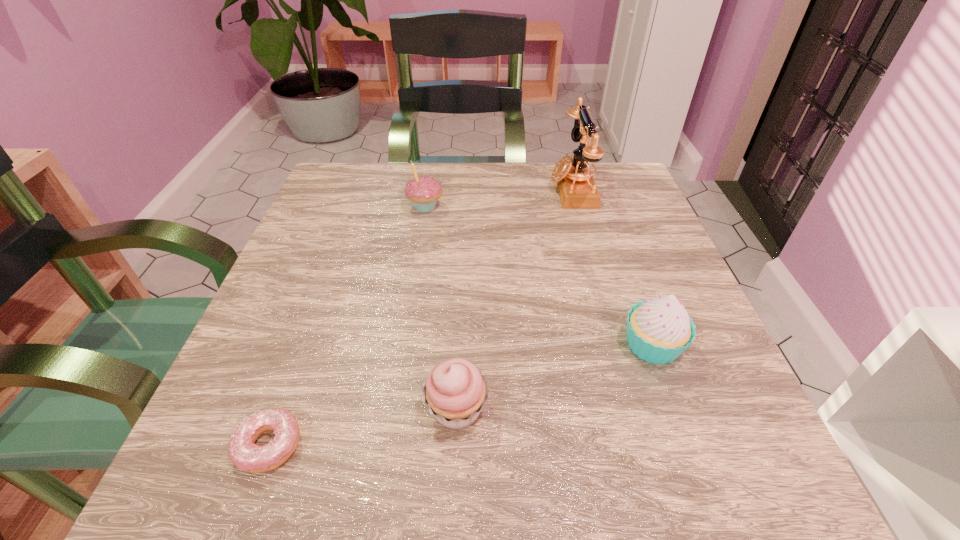
The height and width of the screenshot is (540, 960). Find the location of `vacant space at the far right corner of the desktop`. vacant space at the far right corner of the desktop is located at coordinates (623, 166).

Find the location of a particular element. free point between the tallest object and the leftmost object is located at coordinates (420, 316).

Locate an element on the screen. This screenshot has width=960, height=540. vacant region between the tallest object and the rightmost cupcake is located at coordinates (612, 267).

I want to click on free space between the nearest cupcake and the leftmost object, so click(363, 427).

Identify the location of vacant point located between the shortest object and the tallest object. The height and width of the screenshot is (540, 960). (420, 316).

The image size is (960, 540). In order to click on unoccupied area between the leftmost cupcake and the telephone in this screenshot , I will do `click(498, 198)`.

Where is `blank region between the farthest cupcake and the doughnut`? blank region between the farthest cupcake and the doughnut is located at coordinates (348, 326).

The width and height of the screenshot is (960, 540). Find the location of `vacant area that lies between the leftmost object and the fourth object from right to left`. vacant area that lies between the leftmost object and the fourth object from right to left is located at coordinates (348, 326).

Locate an element on the screen. vacant space that is in between the third farthest object and the telephone is located at coordinates (612, 267).

The width and height of the screenshot is (960, 540). In order to click on free space between the leftmost cupcake and the third farthest object in this screenshot , I will do `click(539, 276)`.